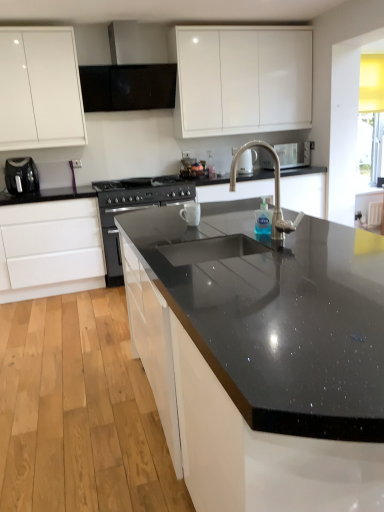
Question: From the image's perspective, is black granite sink at center above or below black matte exhaust hood at upper center?

Choices:
 (A) below
 (B) above

Answer: (A)

Question: Is black granite sink at center bigger or smaller than black matte exhaust hood at upper center?

Choices:
 (A) big
 (B) small

Answer: (A)

Question: Which of these objects is positioned farthest from the black matte exhaust hood at upper center?

Choices:
 (A) satin nickel faucet at upper center, marked as the 1th appliance in a back-to-front arrangement
 (B) black plastic toaster at left, which is the 2th appliance from right to left
 (C) white matte drawer at lower left, marked as the 1th cabinetry in a bottom-to-top arrangement
 (D) polished stainless steel faucet at center
 (E) black granite sink at center

Answer: (A)

Question: Which of these objects is positioned farthest from the black plastic toaster at left, marked as the first appliance in a left-to-right arrangement?

Choices:
 (A) white glossy cabinet at upper left, which ranks as the 2th cabinetry in bottom-to-top order
 (B) polished stainless steel faucet at center
 (C) black matte exhaust hood at upper center
 (D) white matte drawer at lower left, marked as the 1th cabinetry in a bottom-to-top arrangement
 (E) satin nickel faucet at upper center, which is counted as the 2th appliance, starting from the left

Answer: (E)